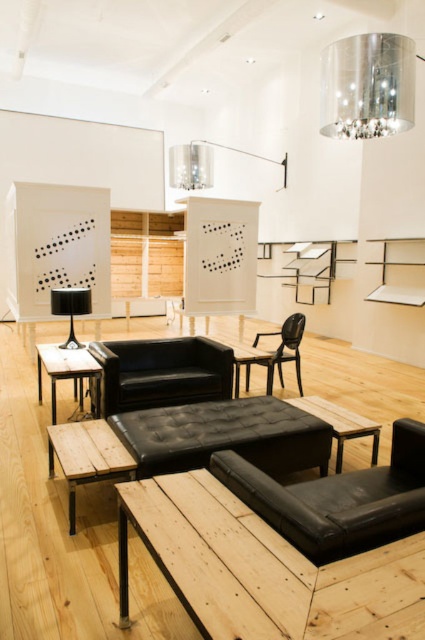
Question: Does wooden table at lower left appear over wooden table at center?

Choices:
 (A) yes
 (B) no

Answer: (A)

Question: Which point appears farthest from the camera in this image?

Choices:
 (A) (328, 420)
 (B) (394, 81)
 (C) (206, 392)

Answer: (C)

Question: Is black leather armchair at lower right thinner than tufted leather ottoman at center?

Choices:
 (A) yes
 (B) no

Answer: (A)

Question: Which point appears farthest from the camera in this image?

Choices:
 (A) (130, 362)
 (B) (302, 388)
 (C) (178, 152)

Answer: (C)

Question: Which point is farther from the camera taking this photo?

Choices:
 (A) (67, 454)
 (B) (178, 182)
 (C) (357, 419)
 (D) (289, 328)

Answer: (B)

Question: Considering the relative positions of wooden plank table at lower left and transparent plastic armchair at center in the image provided, where is wooden plank table at lower left located with respect to transparent plastic armchair at center?

Choices:
 (A) below
 (B) above

Answer: (A)